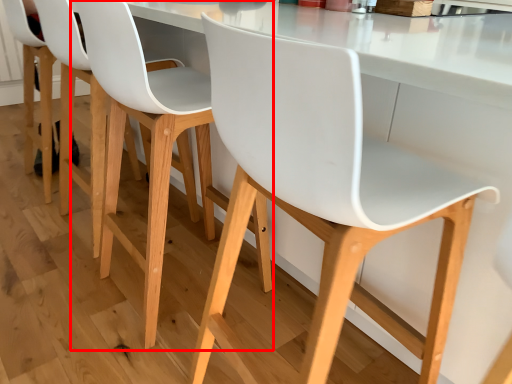
Question: From the image's perspective, where is chair (annotated by the red box) located in relation to chair in the image?

Choices:
 (A) below
 (B) above

Answer: (B)